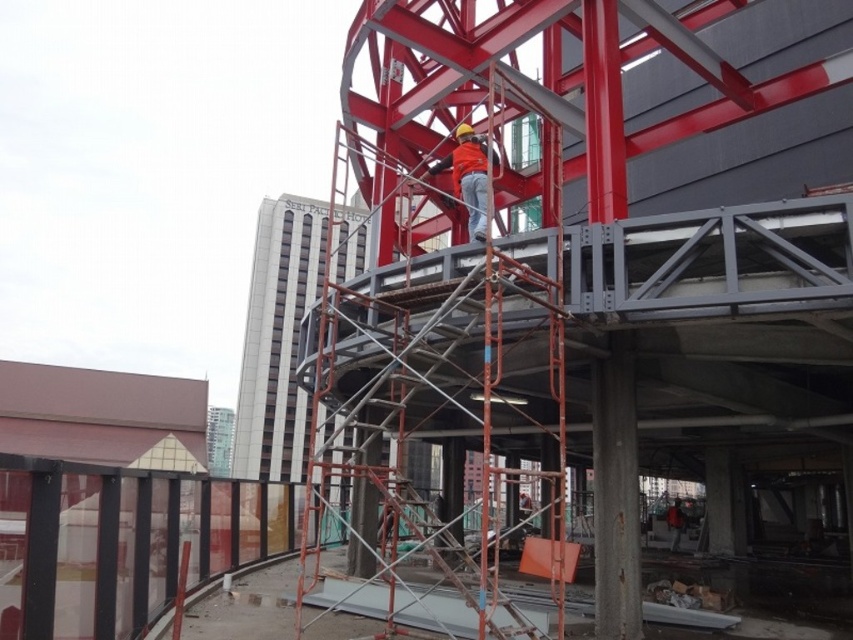
Is metal scaffolding at center bigger than orange fabric construction worker at center?

Yes, metal scaffolding at center is bigger than orange fabric construction worker at center.

In the scene shown: Is metal scaffolding at center thinner than orange fabric construction worker at center?

No.

At what (x,y) coordinates should I click in order to perform the action: click on metal scaffolding at center. Please return your answer as a coordinate pair (x, y). Looking at the image, I should click on (445, 397).

This screenshot has height=640, width=853. I want to click on metal scaffolding at center, so click(x=445, y=397).